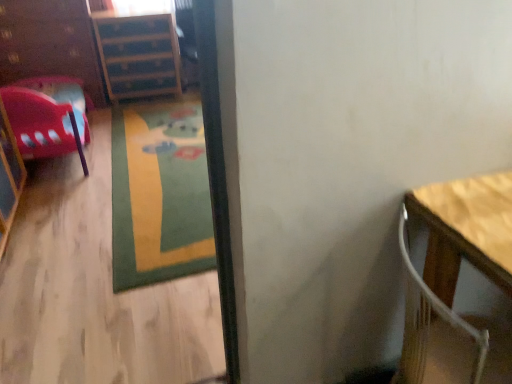
Where is `vacant space situated above green carpet at center (from a real-world perspective)`? vacant space situated above green carpet at center (from a real-world perspective) is located at coordinates (164, 160).